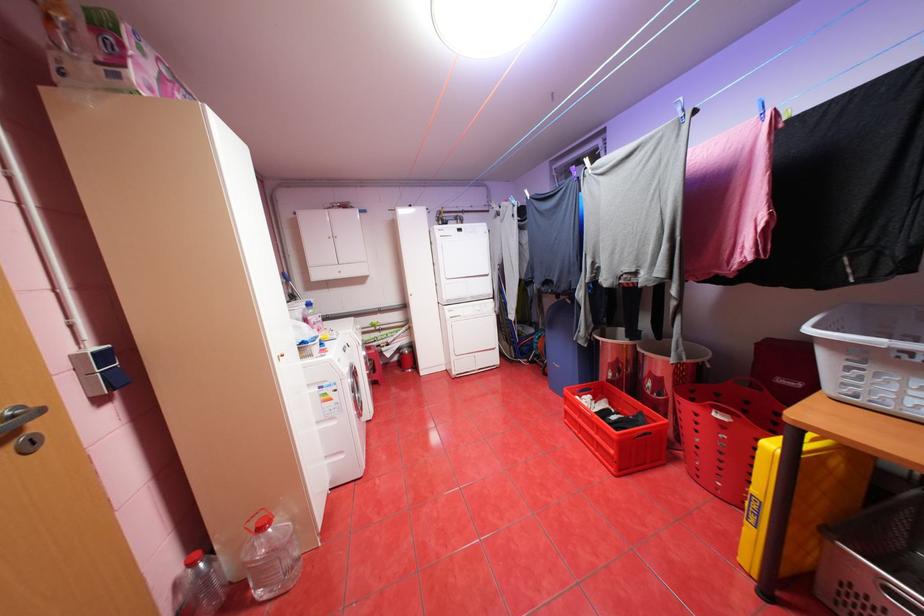
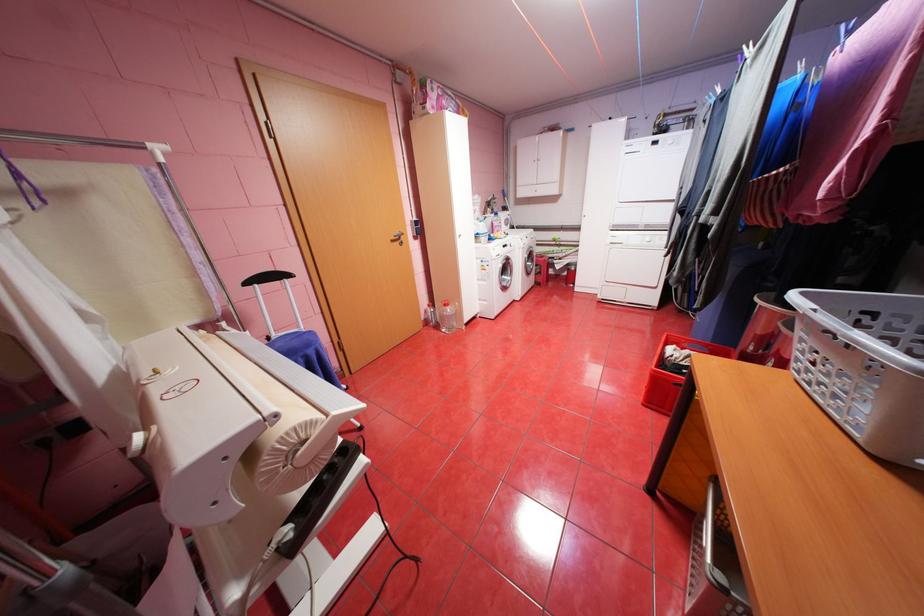
Find the pixel in the second image that matches point 350,456 in the first image.

(494, 302)